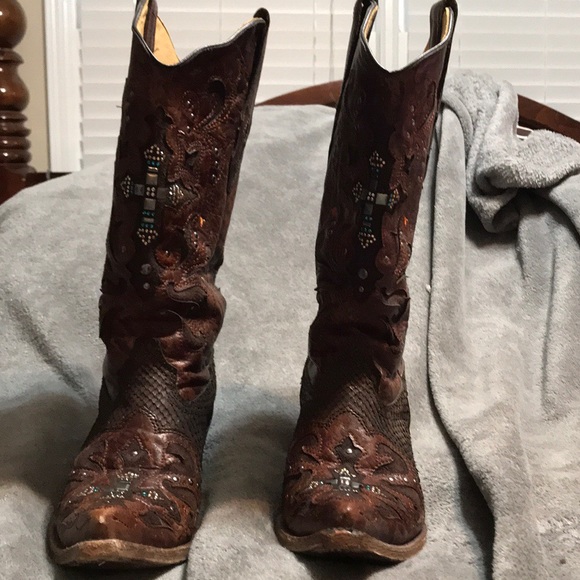
Where is `blinds`? blinds is located at coordinates (317, 72), (499, 63).